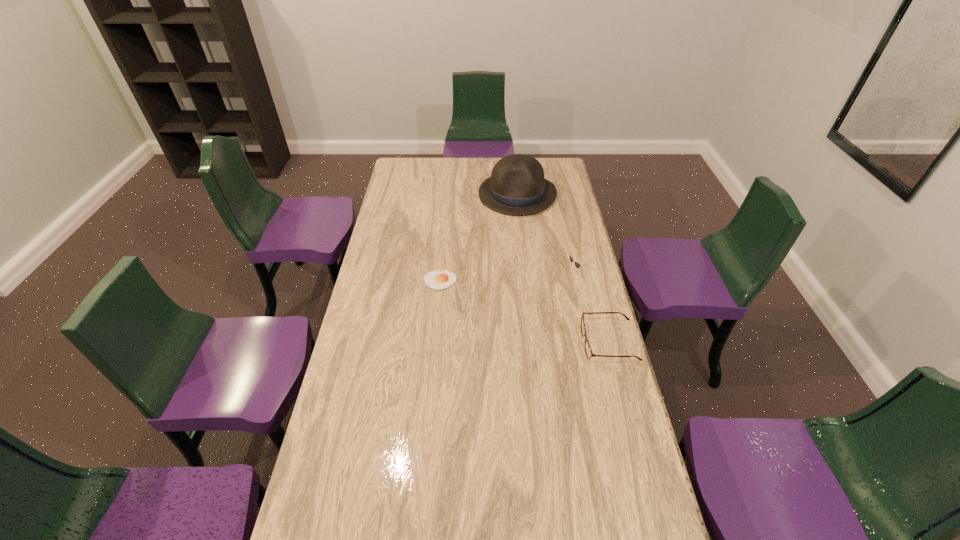
Identify the location of egg yolk. (436, 280).

What are the coordinates of `the shortest object` in the screenshot? It's located at (436, 280).

Find the location of a particular element. This screenshot has height=540, width=960. the third tallest object is located at coordinates (588, 351).

This screenshot has height=540, width=960. Identify the location of spectacles. (588, 351).

The width and height of the screenshot is (960, 540). I want to click on the third shortest object, so click(x=577, y=265).

What are the coordinates of `bowler hat` in the screenshot? It's located at (517, 186).

Find the location of a particular element. the tallest object is located at coordinates (517, 186).

You are a GUI agent. You are given a task and a screenshot of the screen. Output one action in this format:
    pyautogui.click(x=<x>, y=<y>)
    Task: Click on the vacant area situated on the right of the egg yolk
    This screenshot has width=960, height=540.
    Given the screenshot: What is the action you would take?
    pyautogui.click(x=554, y=280)

The height and width of the screenshot is (540, 960). What are the coordinates of `vacant space located on the lenses of the second shortest object` in the screenshot? It's located at tap(492, 342).

This screenshot has height=540, width=960. What are the coordinates of `free space located on the lenses of the second shortest object` in the screenshot? It's located at (498, 342).